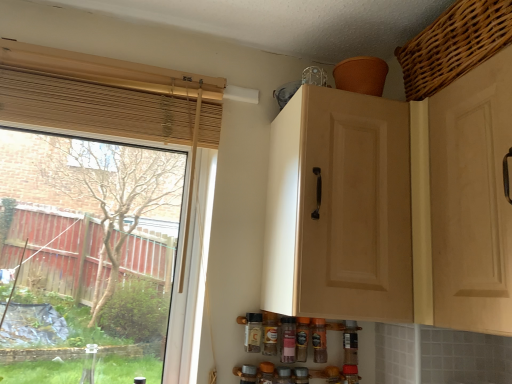
Locate an element on the screen. translucent plastic spice bottle at lower center, the 3th bottle in the left-to-right sequence is located at coordinates (287, 339).

Measure the distance between woven brown basket at upper right and camera.

woven brown basket at upper right and camera are 34.31 inches apart.

Describe the element at coordinates (319, 340) in the screenshot. The width and height of the screenshot is (512, 384). I see `brown glass spice bottle at lower center, which is the first bottle from right to left` at that location.

Where is `brown glass spice bottle at lower center, which is the first bottle from right to left`? brown glass spice bottle at lower center, which is the first bottle from right to left is located at coordinates (319, 340).

Describe the element at coordinates (124, 88) in the screenshot. I see `transparent glass window at left` at that location.

How much space does matte glass spice bottle at lower center, the 5th bottle in the right-to-left sequence, occupy horizontally?

matte glass spice bottle at lower center, the 5th bottle in the right-to-left sequence, is 2.38 inches in width.

What do you see at coordinates (253, 333) in the screenshot? I see `matte glass spice bottle at lower center, the 5th bottle in the right-to-left sequence` at bounding box center [253, 333].

Locate an element on the screen. brown glass spice bottle at center, the 2th bottle from the right is located at coordinates (x=302, y=338).

What is the approximate height of brown glass spice bottle at center, the fourth bottle from the left?

brown glass spice bottle at center, the fourth bottle from the left, is 5.23 inches tall.

The height and width of the screenshot is (384, 512). What are the coordinates of `translucent plastic spice bottle at lower center, the 3th bottle when ordered from right to left` in the screenshot? It's located at (287, 339).

Is point (301, 352) positioned before point (351, 143)?

No.

Which object is thinner, brown glass spice bottle at center, the fourth bottle from the left, or matte wood cabinet at upper center?

brown glass spice bottle at center, the fourth bottle from the left.

Considering the relative sizes of brown glass spice bottle at center, the fourth bottle from the left, and matte wood cabinet at upper center in the image provided, is brown glass spice bottle at center, the fourth bottle from the left, bigger than matte wood cabinet at upper center?

Incorrect, brown glass spice bottle at center, the fourth bottle from the left, is not larger than matte wood cabinet at upper center.

Can you confirm if brown glass spice bottle at center, the 2th bottle from the right, is taller than matte wood cabinet at upper center?

In fact, brown glass spice bottle at center, the 2th bottle from the right, may be shorter than matte wood cabinet at upper center.

Are brown glass spice bottle at lower center, which is the first bottle from right to left, and translucent plastic spice bottle at center, which is counted as the fourth bottle, starting from the right, far apart?

No, brown glass spice bottle at lower center, which is the first bottle from right to left, is not far away from translucent plastic spice bottle at center, which is counted as the fourth bottle, starting from the right.

From a real-world perspective, who is located higher, brown glass spice bottle at lower center, which is the first bottle from right to left, or translucent plastic spice bottle at center, which is counted as the fourth bottle, starting from the right?

translucent plastic spice bottle at center, which is counted as the fourth bottle, starting from the right, from a real-world perspective.

Between brown glass spice bottle at lower center, which is the first bottle from right to left, and translucent plastic spice bottle at center, which is counted as the fourth bottle, starting from the right, which one has larger size?

With larger size is brown glass spice bottle at lower center, which is the first bottle from right to left.

Which is in front, brown glass spice bottle at lower center, the 5th bottle from the left, or translucent plastic spice bottle at center, which is the 2th bottle from left to right?

translucent plastic spice bottle at center, which is the 2th bottle from left to right, is in front.

From the image's perspective, is translucent plastic spice bottle at lower center, the 3th bottle in the left-to-right sequence, under matte wood cabinet at upper center?

Correct, translucent plastic spice bottle at lower center, the 3th bottle in the left-to-right sequence, appears lower than matte wood cabinet at upper center in the image.

Based on their positions, is translucent plastic spice bottle at lower center, the 3th bottle in the left-to-right sequence, located to the left or right of matte wood cabinet at upper center?

Based on their positions, translucent plastic spice bottle at lower center, the 3th bottle in the left-to-right sequence, is located to the left of matte wood cabinet at upper center.

Is point (291, 338) farther from viewer compared to point (354, 209)?

Yes, it is behind point (354, 209).

From a real-world perspective, between translucent plastic spice bottle at lower center, the 3th bottle in the left-to-right sequence, and matte wood cabinet at upper center, who is vertically higher?

matte wood cabinet at upper center is physically above.

Based on the photo, is translucent plastic spice bottle at center, which is counted as the fourth bottle, starting from the right, looking in the opposite direction of matte wood cabinet at upper center?

No, translucent plastic spice bottle at center, which is counted as the fourth bottle, starting from the right,'s orientation is not away from matte wood cabinet at upper center.

Consider the image. Would you say translucent plastic spice bottle at center, which is counted as the fourth bottle, starting from the right, is outside matte wood cabinet at upper center?

Indeed, translucent plastic spice bottle at center, which is counted as the fourth bottle, starting from the right, is completely outside matte wood cabinet at upper center.

From a real-world perspective, is translucent plastic spice bottle at center, which is counted as the fourth bottle, starting from the right, located higher than matte wood cabinet at upper center?

Actually, translucent plastic spice bottle at center, which is counted as the fourth bottle, starting from the right, is physically below matte wood cabinet at upper center in the real world.

Find the location of a particular element. The image size is (512, 384). the 4th bottle below the woven brown basket at upper right (from the image's perspective) is located at coordinates (302, 338).

Is woven brown basket at upper right taller than brown glass spice bottle at center, the fourth bottle from the left?

Correct, woven brown basket at upper right is much taller as brown glass spice bottle at center, the fourth bottle from the left.

How different are the orientations of woven brown basket at upper right and brown glass spice bottle at center, the 2th bottle from the right, in degrees?

woven brown basket at upper right and brown glass spice bottle at center, the 2th bottle from the right, are facing 90 degrees away from each other.

Which is more distant, (472,48) or (303,322)?

The point (303,322) is behind.

Is brown glass spice bottle at center, the 2th bottle from the right, bigger than translucent plastic spice bottle at center, which is counted as the fourth bottle, starting from the right?

Yes, brown glass spice bottle at center, the 2th bottle from the right, is bigger than translucent plastic spice bottle at center, which is counted as the fourth bottle, starting from the right.

Is brown glass spice bottle at center, the fourth bottle from the left, turned away from translucent plastic spice bottle at center, which is the 2th bottle from left to right?

No, brown glass spice bottle at center, the fourth bottle from the left, is not facing the opposite direction of translucent plastic spice bottle at center, which is the 2th bottle from left to right.

From a real-world perspective, is brown glass spice bottle at center, the fourth bottle from the left, beneath translucent plastic spice bottle at center, which is counted as the fourth bottle, starting from the right?

Yes.

In the image, is brown glass spice bottle at center, the 2th bottle from the right, positioned in front of or behind translucent plastic spice bottle at center, which is the 2th bottle from left to right?

Visually, brown glass spice bottle at center, the 2th bottle from the right, is located behind translucent plastic spice bottle at center, which is the 2th bottle from left to right.

Where is `basket on the right of matte glass spice bottle at lower center, placed as the first bottle when sorted from left to right`? The height and width of the screenshot is (384, 512). basket on the right of matte glass spice bottle at lower center, placed as the first bottle when sorted from left to right is located at coordinates (454, 45).

From a real-world perspective, is matte glass spice bottle at lower center, placed as the first bottle when sorted from left to right, positioned above or below woven brown basket at upper right?

matte glass spice bottle at lower center, placed as the first bottle when sorted from left to right, is situated lower than woven brown basket at upper right in the real world.

Is matte glass spice bottle at lower center, the 5th bottle in the right-to-left sequence, not near woven brown basket at upper right?

They are positioned close to each other.

Where is `bottle that is the 5th one below the matte wood cabinet at upper center (from a real-world perspective)`? bottle that is the 5th one below the matte wood cabinet at upper center (from a real-world perspective) is located at coordinates (302, 338).

From the image's perspective, starting from the brown glass spice bottle at lower center, the 5th bottle from the left, which bottle is the 3rd one above? Please provide its 2D coordinates.

[(270, 333)]

Looking at the image, which one is located further to brown glass spice bottle at lower center, the 5th bottle from the left, matte glass spice bottle at lower center, the 5th bottle in the right-to-left sequence, or translucent plastic spice bottle at lower center, the 3th bottle in the left-to-right sequence?

Among the two, matte glass spice bottle at lower center, the 5th bottle in the right-to-left sequence, is located further to brown glass spice bottle at lower center, the 5th bottle from the left.

Considering their positions, is translucent plastic spice bottle at lower center, the 3th bottle when ordered from right to left, positioned closer to translucent plastic spice bottle at center, which is counted as the fourth bottle, starting from the right, than brown glass spice bottle at lower center, which is the first bottle from right to left?

Based on the image, translucent plastic spice bottle at lower center, the 3th bottle when ordered from right to left, appears to be nearer to translucent plastic spice bottle at center, which is counted as the fourth bottle, starting from the right.

Considering their positions, is brown glass spice bottle at lower center, which is the first bottle from right to left, positioned closer to woven brown basket at upper right than translucent plastic spice bottle at center, which is the 2th bottle from left to right?

brown glass spice bottle at lower center, which is the first bottle from right to left, lies closer to woven brown basket at upper right than the other object.

Looking at the image, which one is located closer to translucent plastic spice bottle at lower center, the 3th bottle in the left-to-right sequence, brown glass spice bottle at lower center, which is the first bottle from right to left, or matte wood cabinet at upper center?

The object closer to translucent plastic spice bottle at lower center, the 3th bottle in the left-to-right sequence, is brown glass spice bottle at lower center, which is the first bottle from right to left.

When comparing their distances from translucent plastic spice bottle at lower center, the 3th bottle in the left-to-right sequence, does transparent glass window at left or translucent plastic spice bottle at center, which is the 2th bottle from left to right, seem closer?

Based on the image, translucent plastic spice bottle at center, which is the 2th bottle from left to right, appears to be nearer to translucent plastic spice bottle at lower center, the 3th bottle in the left-to-right sequence.

In the scene shown: Considering their positions, is brown glass spice bottle at center, the fourth bottle from the left, positioned further to matte glass spice bottle at lower center, the 5th bottle in the right-to-left sequence, than brown glass spice bottle at lower center, the 5th bottle from the left?

Based on the image, brown glass spice bottle at lower center, the 5th bottle from the left, appears to be further to matte glass spice bottle at lower center, the 5th bottle in the right-to-left sequence.

Looking at the image, which one is located further to transparent glass window at left, brown glass spice bottle at center, the 2th bottle from the right, or brown glass spice bottle at lower center, which is the first bottle from right to left?

brown glass spice bottle at lower center, which is the first bottle from right to left, is positioned further to the anchor transparent glass window at left.

Considering their positions, is translucent plastic spice bottle at lower center, the 3th bottle in the left-to-right sequence, positioned closer to matte wood cabinet at upper center than woven brown basket at upper right?

The object closer to matte wood cabinet at upper center is woven brown basket at upper right.

This screenshot has width=512, height=384. I want to click on bottle between matte glass spice bottle at lower center, placed as the first bottle when sorted from left to right, and translucent plastic spice bottle at lower center, the 3th bottle when ordered from right to left, from left to right, so click(x=270, y=333).

Locate an element on the screen. This screenshot has height=384, width=512. bottle between woven brown basket at upper right and translucent plastic spice bottle at center, which is counted as the fourth bottle, starting from the right, in the vertical direction is located at coordinates (253, 333).

You are a GUI agent. You are given a task and a screenshot of the screen. Output one action in this format:
    pyautogui.click(x=<x>, y=<y>)
    Task: Click on the cabinetry between woven brown basket at upper right and brown glass spice bottle at center, the 2th bottle from the right, in the up-down direction
    The image size is (512, 384).
    Given the screenshot: What is the action you would take?
    pyautogui.click(x=339, y=209)

You are a GUI agent. You are given a task and a screenshot of the screen. Output one action in this format:
    pyautogui.click(x=<x>, y=<y>)
    Task: Click on the bottle between matte wood cabinet at upper center and translucent plastic spice bottle at center, which is counted as the fourth bottle, starting from the right, vertically
    The height and width of the screenshot is (384, 512).
    Given the screenshot: What is the action you would take?
    pyautogui.click(x=253, y=333)